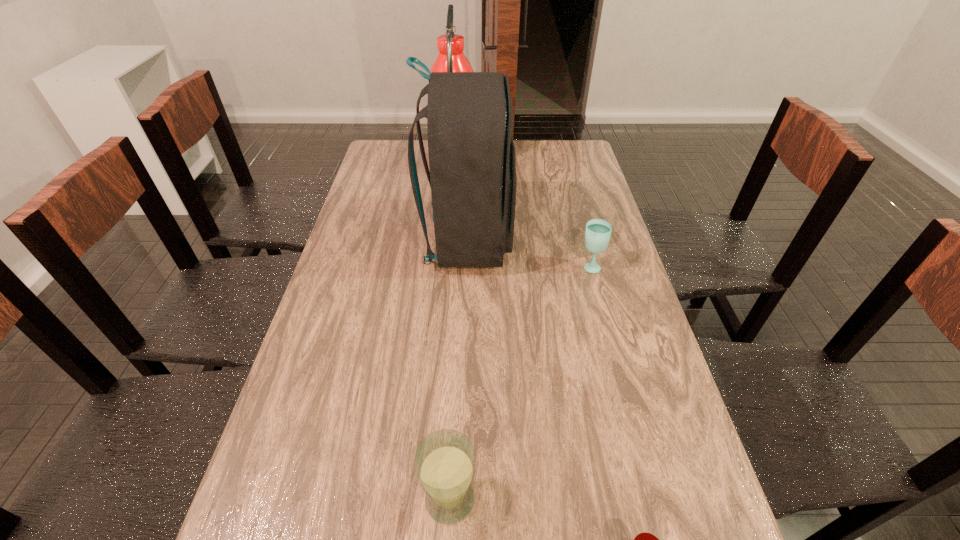
Where is `object that is at the far edge`? object that is at the far edge is located at coordinates [451, 58].

Locate an element on the screen. object that is at the right edge is located at coordinates (598, 231).

You are a GUI agent. You are given a task and a screenshot of the screen. Output one action in this format:
    pyautogui.click(x=<x>, y=<y>)
    Task: Click on the free region at the far edge of the desktop
    The height and width of the screenshot is (540, 960).
    Given the screenshot: What is the action you would take?
    pyautogui.click(x=525, y=163)

In the image, there is a desktop. Where is `vacant space at the left edge`? This screenshot has width=960, height=540. vacant space at the left edge is located at coordinates (324, 352).

Locate an element on the screen. The height and width of the screenshot is (540, 960). vacant space at the right edge of the desktop is located at coordinates (577, 205).

Find the location of `vacant point at the far left corner`. vacant point at the far left corner is located at coordinates (406, 143).

Identify the location of free space at the far right corner. (590, 167).

This screenshot has width=960, height=540. What are the coordinates of `free space between the second tallest glass and the farthest object` in the screenshot? It's located at (522, 217).

Find the location of a particular element. vacant point located between the backpack and the second farthest glass is located at coordinates (459, 370).

Identify the location of vacant space that is in between the backpack and the second shortest object. This screenshot has height=540, width=960. (529, 254).